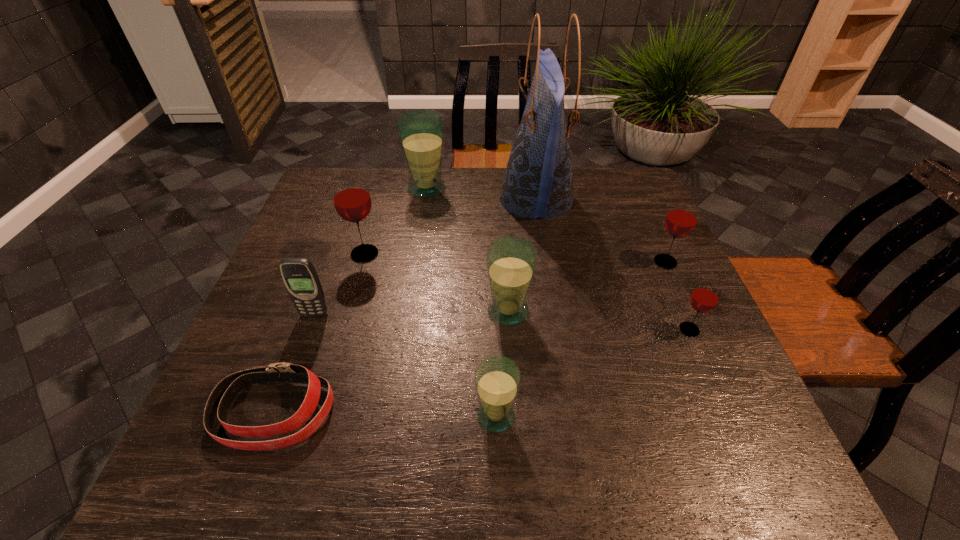
At what (x,y) coordinates should I click in order to perform the action: click on blue shopping bag. Please return your answer as a coordinate pair (x, y). The width and height of the screenshot is (960, 540). Looking at the image, I should click on (538, 182).

This screenshot has width=960, height=540. What are the coordinates of `the tallest object` in the screenshot? It's located at (538, 182).

This screenshot has height=540, width=960. I want to click on the biggest red glass, so click(x=352, y=201).

I want to click on the leftmost glass, so click(x=352, y=201).

Where is `the farthest blue glass`? Image resolution: width=960 pixels, height=540 pixels. the farthest blue glass is located at coordinates (421, 132).

Locate an element on the screen. the farthest glass is located at coordinates (421, 132).

Where is `the second biggest red glass`? The height and width of the screenshot is (540, 960). the second biggest red glass is located at coordinates (681, 219).

Identify the location of the second smallest blue glass. Image resolution: width=960 pixels, height=540 pixels. (511, 261).

Where is `gray cellular telephone`? The width and height of the screenshot is (960, 540). gray cellular telephone is located at coordinates (299, 275).

The image size is (960, 540). Identify the location of the smallest red glass. (705, 297).